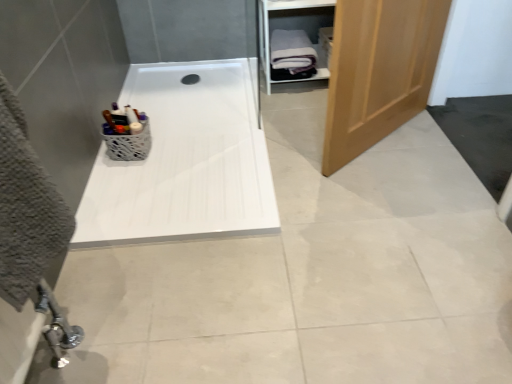
Question: Is white wood cabinet at upper right facing away from white textured basket at upper left?

Choices:
 (A) no
 (B) yes

Answer: (A)

Question: Can you confirm if white wood cabinet at upper right is smaller than white textured basket at upper left?

Choices:
 (A) yes
 (B) no

Answer: (B)

Question: Is white wood cabinet at upper right positioned behind white textured basket at upper left?

Choices:
 (A) yes
 (B) no

Answer: (A)

Question: Does white wood cabinet at upper right have a greater width compared to white textured basket at upper left?

Choices:
 (A) no
 (B) yes

Answer: (B)

Question: Considering the relative sizes of white wood cabinet at upper right and white textured basket at upper left in the image provided, is white wood cabinet at upper right thinner than white textured basket at upper left?

Choices:
 (A) yes
 (B) no

Answer: (B)

Question: Can you confirm if white wood cabinet at upper right is bigger than white textured basket at upper left?

Choices:
 (A) no
 (B) yes

Answer: (B)

Question: Does wooden door at right lie behind white wood cabinet at upper right?

Choices:
 (A) no
 (B) yes

Answer: (A)

Question: From a real-world perspective, is wooden door at right physically below white wood cabinet at upper right?

Choices:
 (A) yes
 (B) no

Answer: (B)

Question: Would you say wooden door at right is a long distance from white wood cabinet at upper right?

Choices:
 (A) yes
 (B) no

Answer: (B)

Question: Is wooden door at right touching white wood cabinet at upper right?

Choices:
 (A) yes
 (B) no

Answer: (B)

Question: Does wooden door at right have a greater height compared to white wood cabinet at upper right?

Choices:
 (A) no
 (B) yes

Answer: (B)

Question: Is wooden door at right surrounding white wood cabinet at upper right?

Choices:
 (A) yes
 (B) no

Answer: (B)

Question: Is white glossy bath at center further to the viewer compared to white wood cabinet at upper right?

Choices:
 (A) yes
 (B) no

Answer: (B)